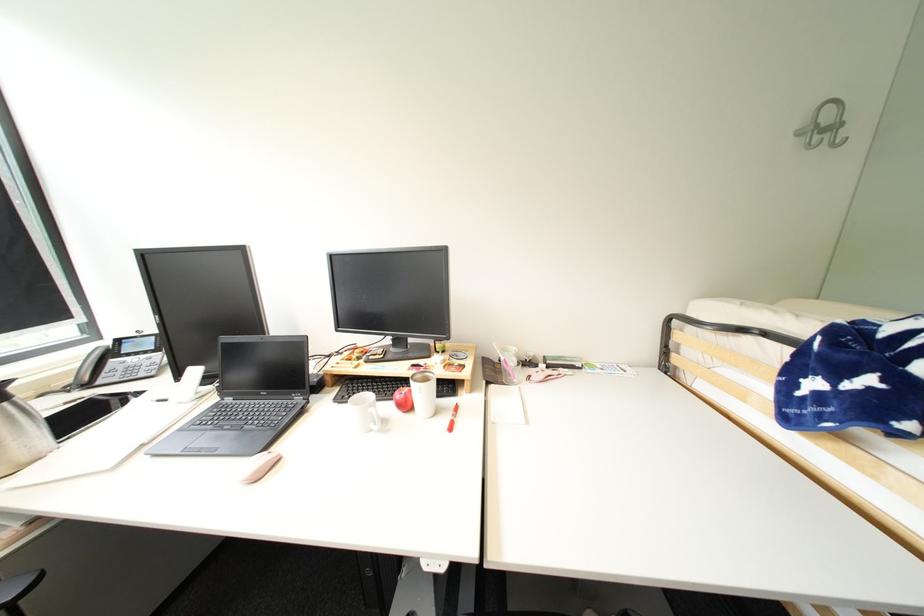
What do you see at coordinates (823, 126) in the screenshot? This screenshot has width=924, height=616. I see `a metal wall hook` at bounding box center [823, 126].